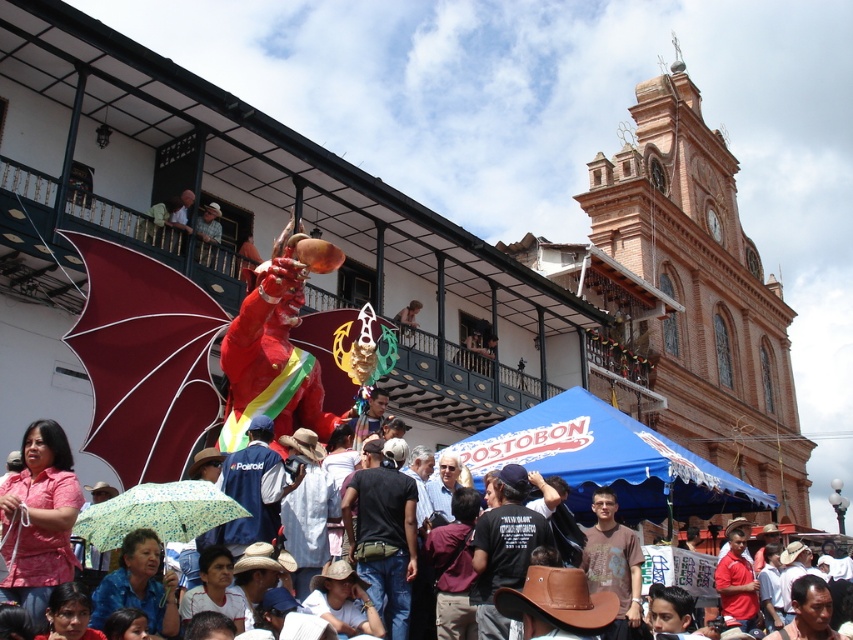
You are standing at the festival and want to take a photo of the dragon performance. There are two points marked in the image. The first point is at coordinate point (561,449) and the second is at point (39,612). Which point should you stand behind to ensure the dragon is fully visible without any obstruction?

You should stand behind point (39,612) because point (561,449) is behind it, so standing behind point (39,612) will keep the dragon visible without obstruction from the other point.

You are standing in the crowd at the festival and see both the burgundy fabric umbrella at left and the light blue fabric umbrella at lower center. Which umbrella is higher up in the image?

The burgundy fabric umbrella at left is above the light blue fabric umbrella at lower center, so it is higher up in the image.